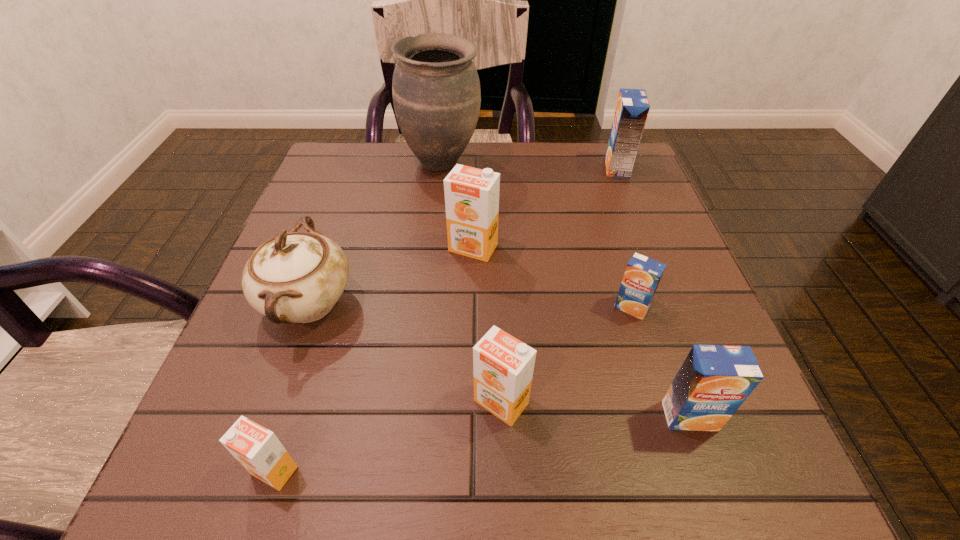
Identify the location of empty location between the second smallest blue orange_juice and the biggest orange orange juice. The image size is (960, 540). (582, 332).

Identify the location of free space between the urn and the nearest orange juice. (358, 316).

The image size is (960, 540). I want to click on blank region between the second smallest blue orange_juice and the nearest orange orange juice, so click(482, 443).

Locate which object is the closest to the second nearest orange orange juice. Please provide its 2D coordinates. Your answer should be formatted as a tuple, i.e. [(x, y)], where the tuple contains the x and y coordinates of a point satisfying the conditions above.

[(714, 380)]

Locate an element on the screen. object that ranks as the sixth closest to the smallest blue orange_juice is located at coordinates (295, 277).

Select which orange juice appears as the third closest to the farthest blue orange_juice. Please provide its 2D coordinates. Your answer should be formatted as a tuple, i.e. [(x, y)], where the tuple contains the x and y coordinates of a point satisfying the conditions above.

[(714, 380)]

What are the coordinates of `orange juice that is the third nearest to the farthest blue orange_juice` in the screenshot? It's located at (714, 380).

Point out which blue orange_juice is positioned as the nearest to the farthest blue orange_juice. Please provide its 2D coordinates. Your answer should be formatted as a tuple, i.e. [(x, y)], where the tuple contains the x and y coordinates of a point satisfying the conditions above.

[(642, 275)]

At what (x,y) coordinates should I click in order to perform the action: click on blue orange_juice identified as the closest to the smallest blue orange_juice. Please return your answer as a coordinate pair (x, y). This screenshot has width=960, height=540. Looking at the image, I should click on (714, 380).

Find the location of a particular element. orange orange juice that stands as the second closest to the biggest blue orange_juice is located at coordinates (503, 366).